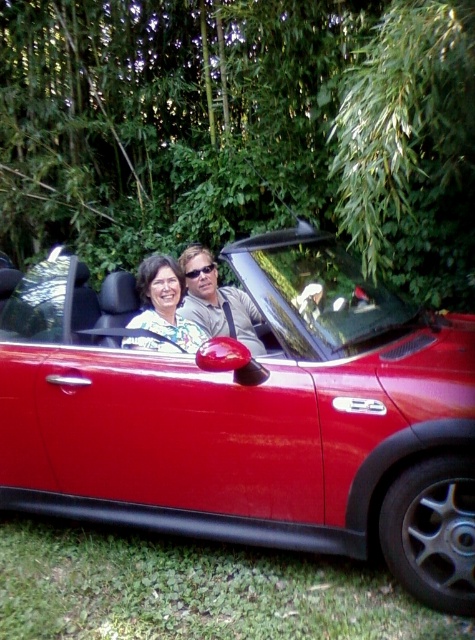
In the scene shown: Between glossy red car at center and matte black couple at center, which one appears on the left side from the viewer's perspective?

Positioned to the left is matte black couple at center.

How much distance is there between glossy red car at center and matte black couple at center?

They are 68.40 centimeters apart.

I want to click on glossy red car at center, so click(x=253, y=417).